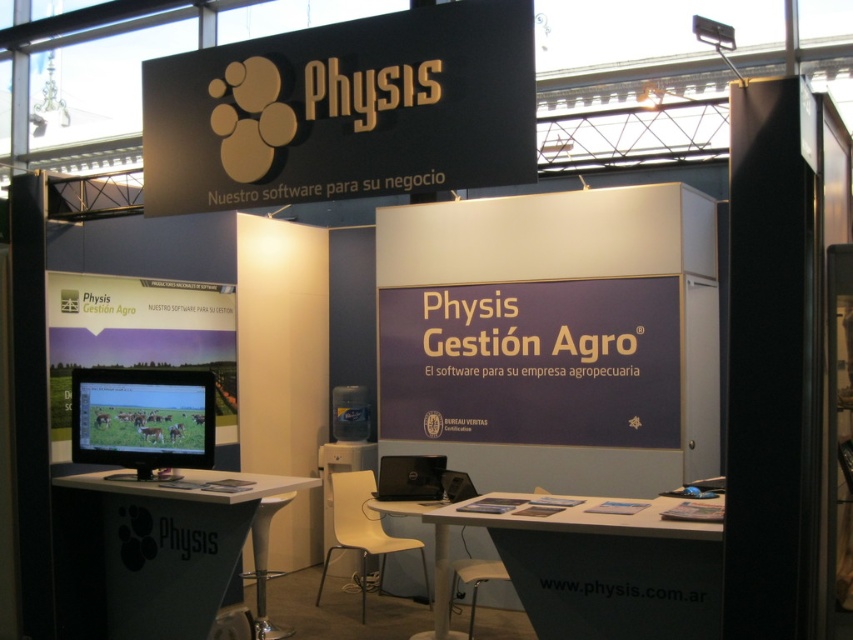
Question: Does black matte sign at upper center have a larger size compared to black plastic laptop at center?

Choices:
 (A) yes
 (B) no

Answer: (A)

Question: Which point is farther to the camera?

Choices:
 (A) metallic stool at center
 (B) matte black monitor at center
 (C) matte plastic signage at left
 (D) white plastic table at center

Answer: (A)

Question: Is white plastic table at center thinner than metallic stool at center?

Choices:
 (A) yes
 (B) no

Answer: (B)

Question: Which point is closer to the camera?

Choices:
 (A) black matte sign at upper center
 (B) black plastic laptop at center

Answer: (A)

Question: Which object is positioned closest to the matte plastic signage at left?

Choices:
 (A) white matte table at center
 (B) metallic stool at center

Answer: (A)

Question: Does black plastic laptop at center appear under metallic stool at center?

Choices:
 (A) no
 (B) yes

Answer: (A)